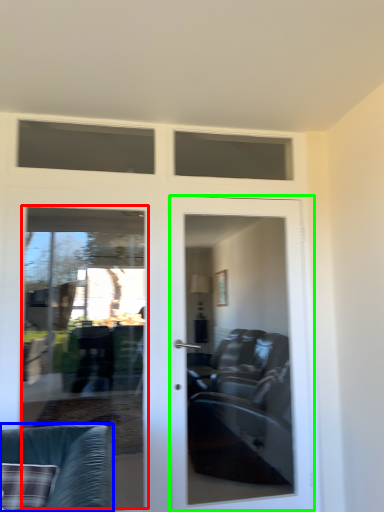
Question: Which object is positioned closest to screen door (highlighted by a red box)? Select from chair (highlighted by a blue box) and door (highlighted by a green box).

Choices:
 (A) chair
 (B) door

Answer: (B)